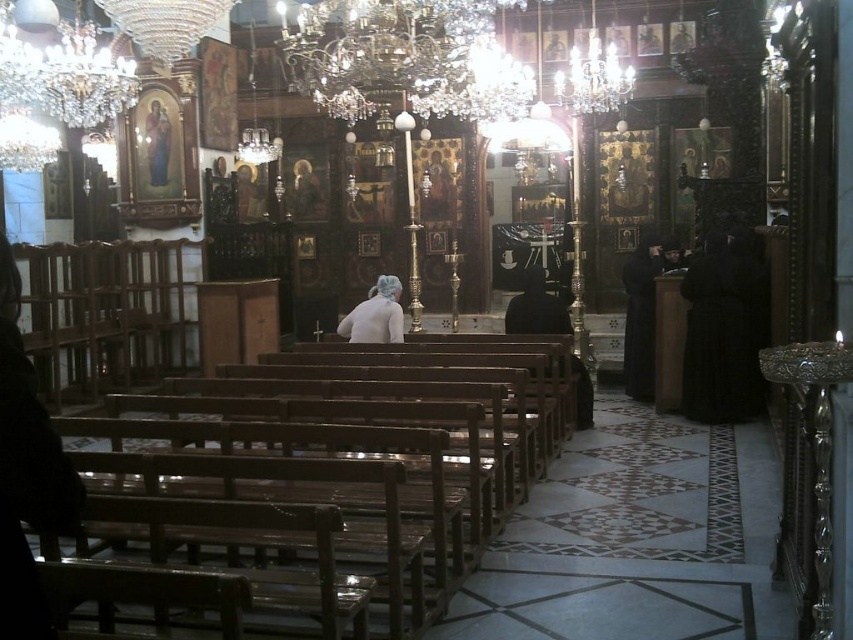
You are standing in the church and want to place a new icon between the crystal glass chandelier at upper center and the black velvet robe at center. According to their positions, which object should the icon be closer to?

The crystal glass chandelier at upper center is to the left of the black velvet robe at center. Therefore, placing the icon between them would mean it is closer to the crystal glass chandelier at upper center since it is positioned to the left of the robe.

You are a photographer standing at the back of the church, aiming to capture a clear shot of the black matte robe at center and the white matte hair at center. Which object should you focus on first if you want to ensure both are in focus without adjusting your camera settings?

The black matte robe at center has a greater height compared to the white matte hair at center, so focusing on the taller object first will help maintain focus on both since they are positioned at the same central area.